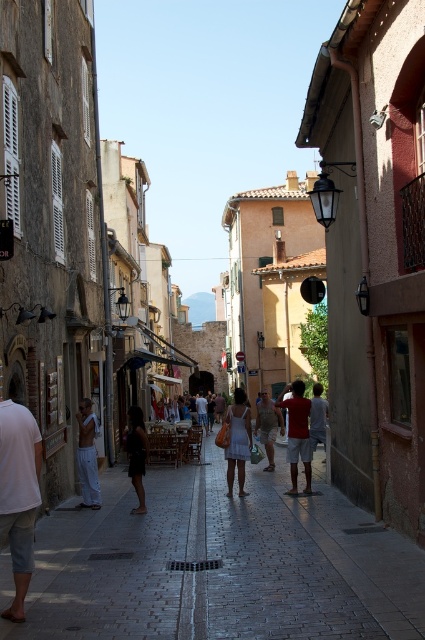
Does brick paved street at center appear on the left side of light brown leather pants at center?

Indeed, brick paved street at center is positioned on the left side of light brown leather pants at center.

What do you see at coordinates (221, 564) in the screenshot? Image resolution: width=425 pixels, height=640 pixels. I see `brick paved street at center` at bounding box center [221, 564].

Between point (59, 593) and point (314, 388), which one is positioned in front?

Point (59, 593) is in front.

At what (x,y) coordinates should I click in order to perform the action: click on brick paved street at center. Please return your answer as a coordinate pair (x, y). Looking at the image, I should click on (221, 564).

Is brick paved street at center positioned before dark gray dress at center?

That is True.

Who is more forward, (229,561) or (127,449)?

Point (229,561)

Where is `brick paved street at center`? brick paved street at center is located at coordinates tap(221, 564).

Describe the element at coordinates (87, 456) in the screenshot. I see `white cotton pants at left` at that location.

Can you confirm if white cotton pants at left is bigger than khaki cotton shorts at center?

Indeed, white cotton pants at left has a larger size compared to khaki cotton shorts at center.

This screenshot has height=640, width=425. What do you see at coordinates (87, 456) in the screenshot?
I see `white cotton pants at left` at bounding box center [87, 456].

What are the coordinates of `white cotton pants at left` in the screenshot? It's located at (87, 456).